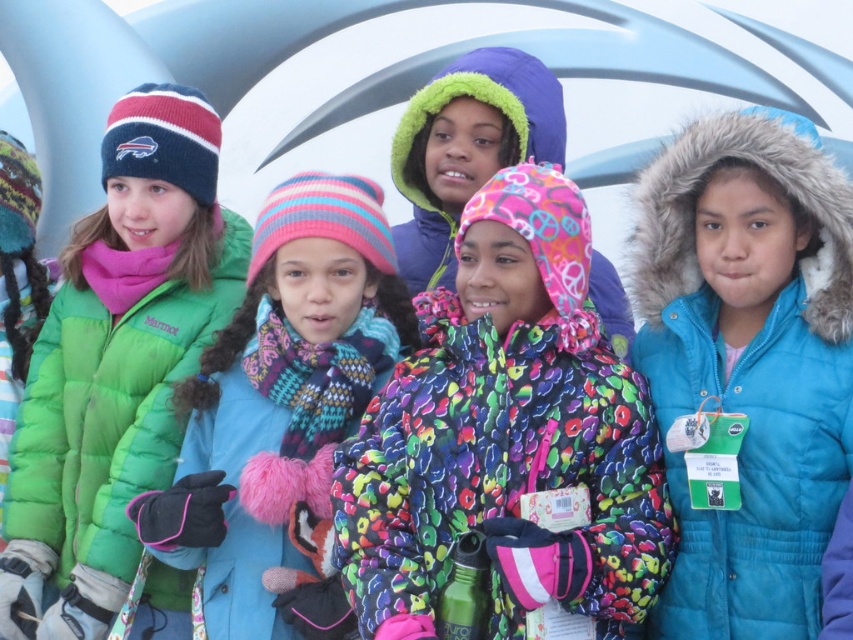
Is point (624, 528) closer to viewer compared to point (100, 516)?

Yes, point (624, 528) is closer to viewer.

Between point (467, 444) and point (28, 388), which one is positioned in front?

Point (467, 444)

Between point (592, 467) and point (178, 355), which one is positioned behind?

The point (178, 355) is behind.

Where is `floral-patterned jacket at center`? The height and width of the screenshot is (640, 853). floral-patterned jacket at center is located at coordinates pos(506,435).

Who is more forward, (x=136, y=529) or (x=611, y=321)?

Positioned in front is point (x=136, y=529).

Which of these two, pink knitted hat at center or multicolored fleece jacket at center, stands shorter?

With less height is multicolored fleece jacket at center.

Who is more forward, (x=218, y=502) or (x=471, y=115)?

Point (x=218, y=502) is in front.

Locate an element on the screen. The image size is (853, 640). pink knitted hat at center is located at coordinates (280, 396).

This screenshot has height=640, width=853. I want to click on blue fuzzy coat at right, so click(749, 365).